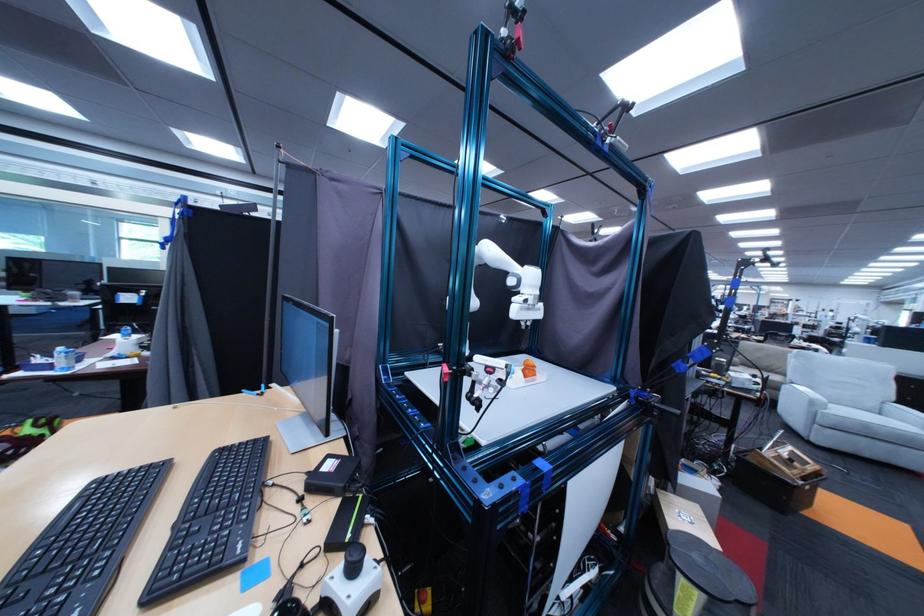
At what (x,y) coordinates should I click in order to perform the action: click on black control knob. Please return your answer as a coordinate pair (x, y). Looking at the image, I should click on (351, 567).